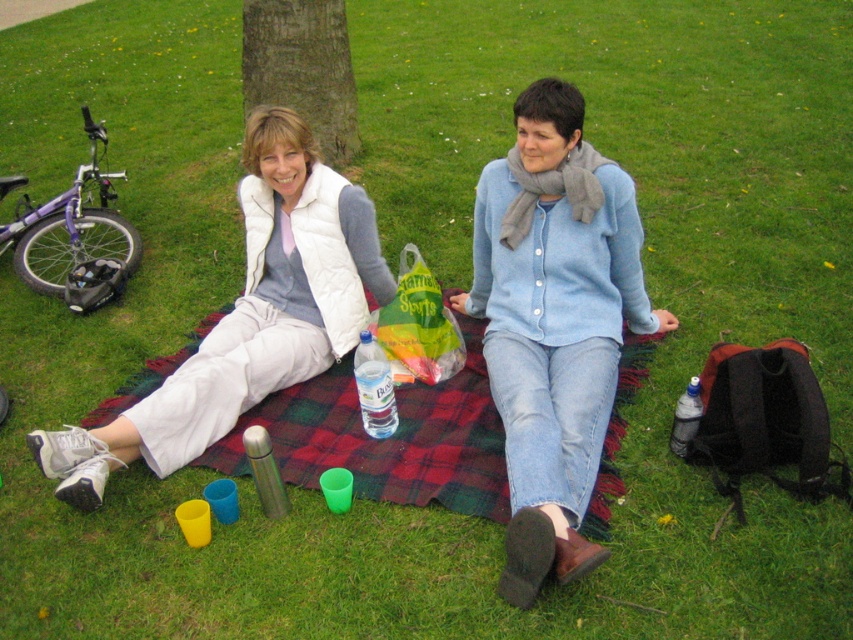
Question: Which point is farther to the camera?

Choices:
 (A) clear plastic bottle at center
 (B) translucent plastic bottle at lower right
 (C) plaid fabric blanket at center

Answer: (A)

Question: Is white puffy vest at upper left wider than clear plastic bottle at center?

Choices:
 (A) yes
 (B) no

Answer: (A)

Question: Does white puffy vest at upper left have a larger size compared to brown textured tree at upper center?

Choices:
 (A) no
 (B) yes

Answer: (B)

Question: Can you confirm if white puffy vest at upper left is thinner than translucent plastic bottle at lower right?

Choices:
 (A) no
 (B) yes

Answer: (A)

Question: Which of the following is the closest to the observer?

Choices:
 (A) (674, 451)
 (B) (386, 410)
 (C) (251, 84)
 (D) (465, 429)

Answer: (A)

Question: Which object is positioned farthest from the white puffy vest at upper left?

Choices:
 (A) brown textured tree at upper center
 (B) translucent plastic bottle at lower right

Answer: (A)